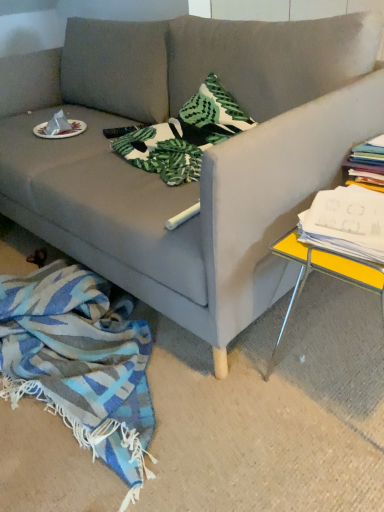
Locate an element on the screen. The height and width of the screenshot is (512, 384). free space to the left of yellow metallic table at right is located at coordinates (253, 376).